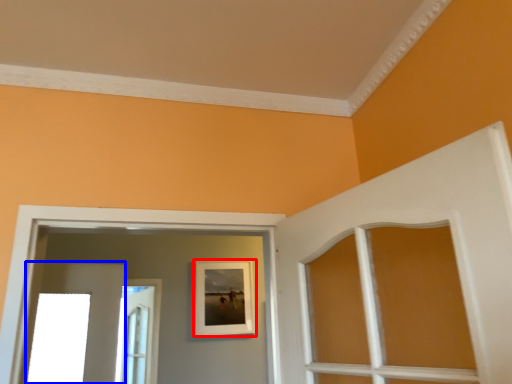
Question: Which point is further to the camera, picture frame (highlighted by a red box) or door (highlighted by a blue box)?

Choices:
 (A) picture frame
 (B) door

Answer: (B)